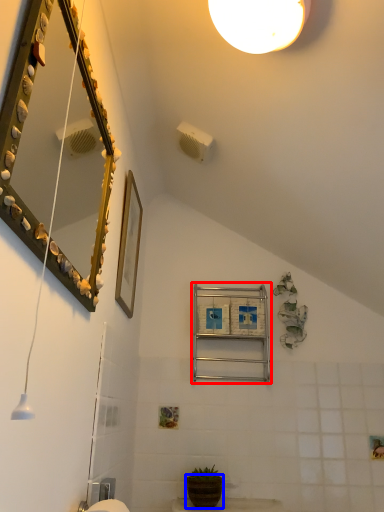
Question: Which point is closer to the camera, ladder (highlighted by a red box) or flowerpot (highlighted by a blue box)?

Choices:
 (A) ladder
 (B) flowerpot

Answer: (B)